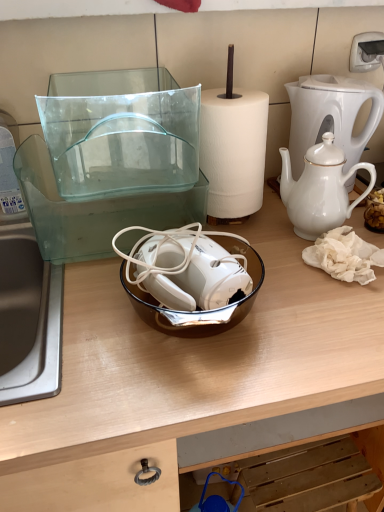
Question: Would you say transparent glass bowl at center is part of white glossy coffee maker at upper right's contents?

Choices:
 (A) no
 (B) yes

Answer: (A)

Question: Is white glossy coffee maker at upper right thinner than transparent glass bowl at center?

Choices:
 (A) no
 (B) yes

Answer: (B)

Question: Considering the relative positions of white glossy coffee maker at upper right and transparent glass bowl at center in the image provided, is white glossy coffee maker at upper right to the left of transparent glass bowl at center from the viewer's perspective?

Choices:
 (A) yes
 (B) no

Answer: (B)

Question: From a real-world perspective, is white glossy coffee maker at upper right located higher than transparent glass bowl at center?

Choices:
 (A) no
 (B) yes

Answer: (B)

Question: Can you confirm if white glossy coffee maker at upper right is smaller than transparent glass bowl at center?

Choices:
 (A) no
 (B) yes

Answer: (B)

Question: Does white glossy coffee maker at upper right appear on the right side of transparent glass bowl at center?

Choices:
 (A) yes
 (B) no

Answer: (A)

Question: Is brown glass bowl at center taller than white glossy coffee maker at upper right?

Choices:
 (A) yes
 (B) no

Answer: (B)

Question: Is brown glass bowl at center at the left side of white glossy coffee maker at upper right?

Choices:
 (A) yes
 (B) no

Answer: (A)

Question: Is brown glass bowl at center located outside white glossy coffee maker at upper right?

Choices:
 (A) yes
 (B) no

Answer: (A)

Question: Does brown glass bowl at center have a greater width compared to white glossy coffee maker at upper right?

Choices:
 (A) yes
 (B) no

Answer: (A)

Question: Is brown glass bowl at center in front of white glossy coffee maker at upper right?

Choices:
 (A) no
 (B) yes

Answer: (B)

Question: Can you confirm if brown glass bowl at center is shorter than white glossy coffee maker at upper right?

Choices:
 (A) yes
 (B) no

Answer: (A)

Question: Considering the relative sizes of transparent glass bowl at center and brown glass bowl at center in the image provided, is transparent glass bowl at center shorter than brown glass bowl at center?

Choices:
 (A) yes
 (B) no

Answer: (B)